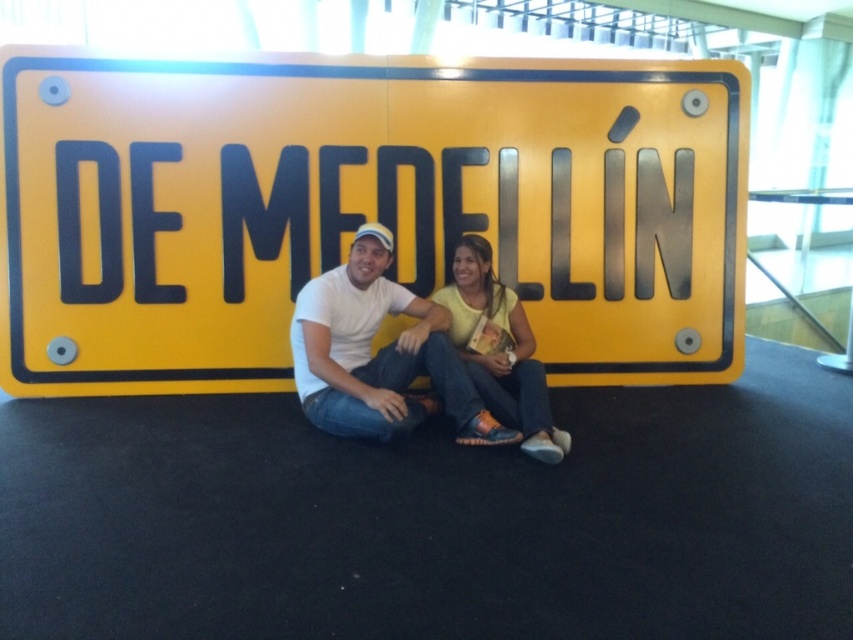
Question: In this image, where is yellow matte sign at center located relative to white matte t-shirt at center?

Choices:
 (A) below
 (B) above

Answer: (B)

Question: From the image, what is the correct spatial relationship of yellow matte sign at center in relation to white matte t-shirt at center?

Choices:
 (A) below
 (B) above

Answer: (B)

Question: Considering the real-world distances, which object is closest to the yellow matte sign at center?

Choices:
 (A) yellow matte shirt at center
 (B) white matte t-shirt at center

Answer: (B)

Question: Which point is farther to the camera?

Choices:
 (A) (717, 310)
 (B) (311, 381)

Answer: (A)

Question: Is the position of white matte t-shirt at center less distant than that of yellow matte shirt at center?

Choices:
 (A) yes
 (B) no

Answer: (B)

Question: Which point is closer to the camera?

Choices:
 (A) yellow matte shirt at center
 (B) white matte t-shirt at center

Answer: (A)